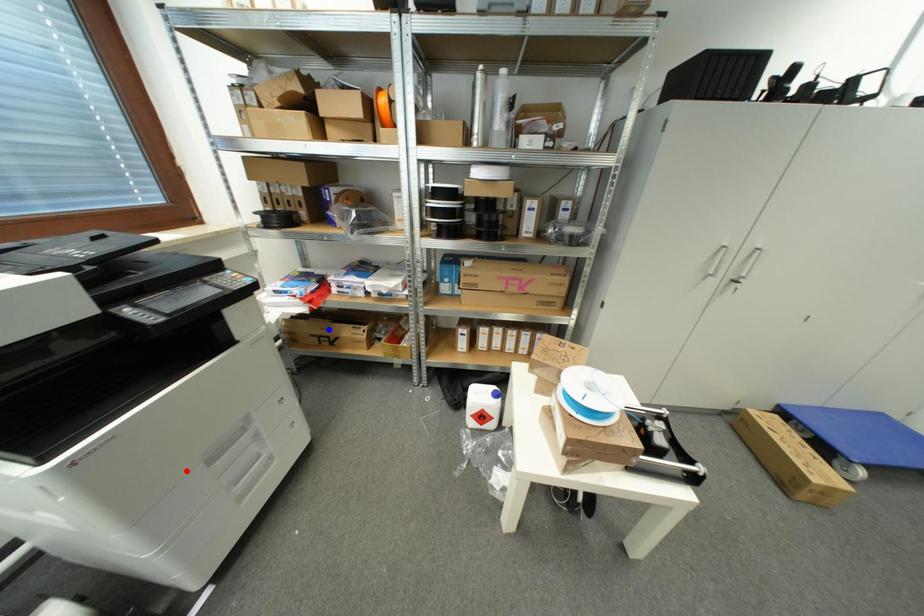
Question: Two points are marked on the image. Which point is closer to the camera?

Choices:
 (A) Blue point is closer.
 (B) Red point is closer.

Answer: (B)